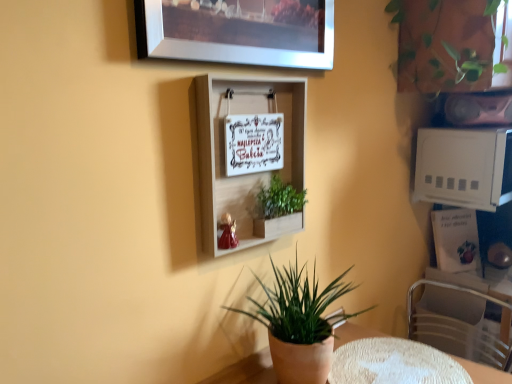
Find the location of a particular element. This screenshot has height=384, width=512. green matte plant pot at lower center, the 1th houseplant ordered from the bottom is located at coordinates (300, 323).

In order to click on green leafy plant at upper right, which is counted as the third houseplant, starting from the bottom in this screenshot , I will do `click(453, 45)`.

Describe the element at coordinates (453, 45) in the screenshot. I see `green leafy plant at upper right, the first houseplant viewed from the top` at that location.

The image size is (512, 384). Describe the element at coordinates (458, 330) in the screenshot. I see `metallic silver swivel chair at lower right` at that location.

Locate an element on the screen. The height and width of the screenshot is (384, 512). green matte plant at center, the first houseplant when ordered from left to right is located at coordinates (278, 209).

Identify the location of white textured table at lower center. (246, 371).

Find the location of a particular element. white plastic microwave at upper right is located at coordinates (464, 167).

Describe the element at coordinates (238, 31) in the screenshot. The height and width of the screenshot is (384, 512). I see `metallic silver picture frame at upper center` at that location.

I want to click on green matte plant pot at lower center, which is the third houseplant from top to bottom, so click(x=300, y=323).

Based on their sizes in the image, would you say green matte plant pot at lower center, which is the third houseplant from top to bottom, is bigger or smaller than green leafy plant at upper right, which is the 1th houseplant in right-to-left order?

Clearly, green matte plant pot at lower center, which is the third houseplant from top to bottom, is smaller in size than green leafy plant at upper right, which is the 1th houseplant in right-to-left order.

Relative to green leafy plant at upper right, the 3th houseplant in the left-to-right sequence, is green matte plant pot at lower center, which is the third houseplant from top to bottom, in front or behind?

Visually, green matte plant pot at lower center, which is the third houseplant from top to bottom, is located in front of green leafy plant at upper right, the 3th houseplant in the left-to-right sequence.

Looking at their sizes, would you say green matte plant pot at lower center, marked as the second houseplant in a right-to-left arrangement, is wider or thinner than green leafy plant at upper right, which is the 1th houseplant in right-to-left order?

Considering their sizes, green matte plant pot at lower center, marked as the second houseplant in a right-to-left arrangement, looks slimmer than green leafy plant at upper right, which is the 1th houseplant in right-to-left order.

Which of these two, metallic silver swivel chair at lower right or white textured table at lower center, is smaller?

With smaller size is white textured table at lower center.

From a real-world perspective, between metallic silver swivel chair at lower right and white textured table at lower center, who is vertically higher?

white textured table at lower center is physically above.

Does metallic silver swivel chair at lower right turn towards white textured table at lower center?

No, metallic silver swivel chair at lower right is not aimed at white textured table at lower center.

Is metallic silver swivel chair at lower right to the right of white textured table at lower center from the viewer's perspective?

Yes.

Does metallic silver picture frame at upper center turn towards metallic silver swivel chair at lower right?

No, metallic silver picture frame at upper center does not turn towards metallic silver swivel chair at lower right.

From a real-world perspective, does metallic silver picture frame at upper center sit lower than metallic silver swivel chair at lower right?

No, from a real-world perspective, metallic silver picture frame at upper center is not below metallic silver swivel chair at lower right.

Considering the relative sizes of metallic silver picture frame at upper center and metallic silver swivel chair at lower right in the image provided, is metallic silver picture frame at upper center taller than metallic silver swivel chair at lower right?

No, metallic silver picture frame at upper center is not taller than metallic silver swivel chair at lower right.

Can you confirm if metallic silver swivel chair at lower right is bigger than green matte plant at center, placed as the second houseplant when sorted from top to bottom?

Yes.

Between metallic silver swivel chair at lower right and green matte plant at center, placed as the second houseplant when sorted from top to bottom, which one appears on the left side from the viewer's perspective?

green matte plant at center, placed as the second houseplant when sorted from top to bottom.

What's the angular difference between metallic silver swivel chair at lower right and green matte plant at center, placed as the second houseplant when sorted from top to bottom,'s facing directions?

There is a 4.26-degree angle between the facing directions of metallic silver swivel chair at lower right and green matte plant at center, placed as the second houseplant when sorted from top to bottom.

Which of these two, metallic silver swivel chair at lower right or green matte plant at center, which is counted as the 2th houseplant, starting from the bottom, is wider?

Wider between the two is metallic silver swivel chair at lower right.

Would you say white plastic microwave at upper right is outside metallic silver picture frame at upper center?

Yes, white plastic microwave at upper right is located beyond the bounds of metallic silver picture frame at upper center.

Is white plastic microwave at upper right positioned with its back to metallic silver picture frame at upper center?

No, metallic silver picture frame at upper center is not at the back of white plastic microwave at upper right.

Which is behind, point (467, 203) or point (276, 39)?

The point (467, 203) is farther from the camera.

In the image, is white plastic microwave at upper right positioned in front of or behind metallic silver picture frame at upper center?

Clearly, white plastic microwave at upper right is behind metallic silver picture frame at upper center.

From the image's perspective, does white plastic microwave at upper right appear higher than white wooden shelf at center?

Yes, from the image's perspective, white plastic microwave at upper right is above white wooden shelf at center.

From the picture: Is white plastic microwave at upper right next to white wooden shelf at center and touching it?

They are not placed beside each other.

Which object is thinner, white plastic microwave at upper right or white wooden shelf at center?

Thinner between the two is white wooden shelf at center.

Can you confirm if white textured table at lower center is bigger than metallic silver picture frame at upper center?

Incorrect, white textured table at lower center is not larger than metallic silver picture frame at upper center.

Could you measure the distance between white textured table at lower center and metallic silver picture frame at upper center?

They are 37.30 inches apart.

From the image's perspective, which one is positioned higher, white textured table at lower center or metallic silver picture frame at upper center?

metallic silver picture frame at upper center appears higher in the image.

Which point is more forward, (x=246, y=359) or (x=274, y=64)?

The point (x=274, y=64) is closer to the camera.

Identify the location of the 2nd houseplant positioned above the green matte plant pot at lower center, the 1th houseplant ordered from the bottom (from a real-world perspective). (453, 45).

I want to click on swivel chair located underneath the white textured table at lower center (from a real-world perspective), so click(458, 330).

Estimate the real-world distances between objects in this image. Which object is further from green matte plant pot at lower center, which is the third houseplant from top to bottom, white wooden shelf at center or white textured table at lower center?

The object further to green matte plant pot at lower center, which is the third houseplant from top to bottom, is white textured table at lower center.

Looking at the image, which one is located closer to white textured table at lower center, green matte plant pot at lower center, which is the second houseplant from left to right, or green leafy plant at upper right, the first houseplant viewed from the top?

green matte plant pot at lower center, which is the second houseplant from left to right, lies closer to white textured table at lower center than the other object.

Which object lies nearer to the anchor point green matte plant pot at lower center, marked as the second houseplant in a right-to-left arrangement, green matte plant at center, the first houseplant when ordered from left to right, or white plastic microwave at upper right?

The object closer to green matte plant pot at lower center, marked as the second houseplant in a right-to-left arrangement, is green matte plant at center, the first houseplant when ordered from left to right.

When comparing their distances from green leafy plant at upper right, which is counted as the third houseplant, starting from the bottom, does green matte plant pot at lower center, which is the second houseplant from left to right, or green matte plant at center, the first houseplant when ordered from left to right, seem closer?

Among the two, green matte plant at center, the first houseplant when ordered from left to right, is located nearer to green leafy plant at upper right, which is counted as the third houseplant, starting from the bottom.

Based on their spatial positions, is green matte plant at center, placed as the second houseplant when sorted from top to bottom, or white wooden shelf at center further from green leafy plant at upper right, the 3th houseplant in the left-to-right sequence?

green matte plant at center, placed as the second houseplant when sorted from top to bottom, is positioned further to the anchor green leafy plant at upper right, the 3th houseplant in the left-to-right sequence.

Estimate the real-world distances between objects in this image. Which object is closer to green matte plant at center, which is counted as the third houseplant, starting from the right, white wooden shelf at center or green matte plant pot at lower center, which is the third houseplant from top to bottom?

white wooden shelf at center is positioned closer to the anchor green matte plant at center, which is counted as the third houseplant, starting from the right.

Based on the photo, looking at the image, which one is located closer to green matte plant pot at lower center, which is the second houseplant from left to right, white plastic microwave at upper right or metallic silver swivel chair at lower right?

white plastic microwave at upper right is positioned closer to the anchor green matte plant pot at lower center, which is the second houseplant from left to right.

Based on their spatial positions, is metallic silver picture frame at upper center or white textured table at lower center closer to green leafy plant at upper right, the first houseplant viewed from the top?

metallic silver picture frame at upper center is closer to green leafy plant at upper right, the first houseplant viewed from the top.

Identify the location of shelf between metallic silver picture frame at upper center and white textured table at lower center in the up-down direction. (231, 156).

Find the location of a particular element. appliance between green matte plant pot at lower center, which is the second houseplant from left to right, and metallic silver swivel chair at lower right, in the horizontal direction is located at coordinates (464, 167).

This screenshot has height=384, width=512. In order to click on table between green matte plant pot at lower center, which is the second houseplant from left to right, and metallic silver swivel chair at lower right, in the horizontal direction in this screenshot , I will do pyautogui.click(x=246, y=371).

Locate an element on the screen. The width and height of the screenshot is (512, 384). appliance located between metallic silver picture frame at upper center and metallic silver swivel chair at lower right in the left-right direction is located at coordinates (464, 167).